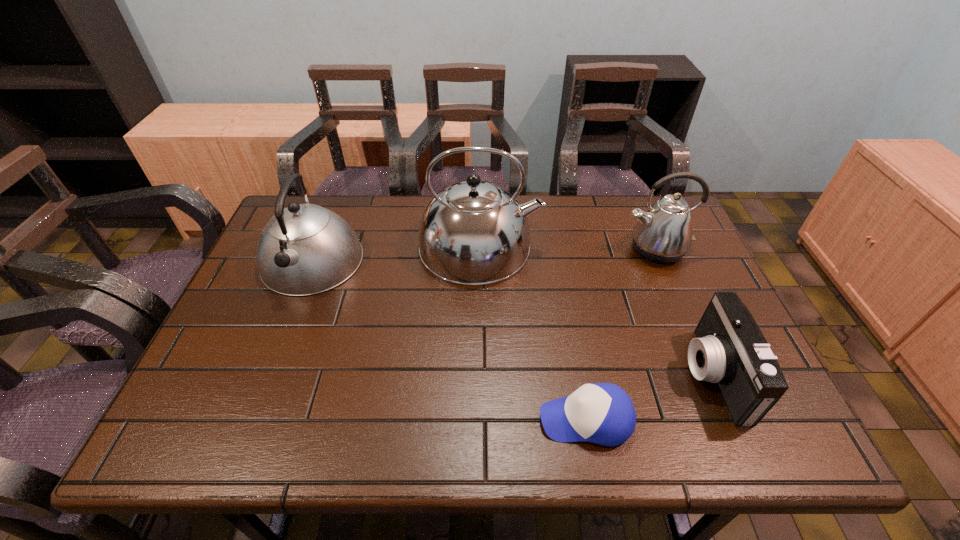
You are a GUI agent. You are given a task and a screenshot of the screen. Output one action in this format:
    pyautogui.click(x=<x>, y=<y>)
    Task: Click on the vacant space positioned 0.260m on the lens of the fourth tallest object
    Image resolution: width=960 pixels, height=540 pixels.
    Given the screenshot: What is the action you would take?
    pos(573,375)

The height and width of the screenshot is (540, 960). In order to click on free space located on the lens of the fourth tallest object in this screenshot , I will do `click(600, 375)`.

The width and height of the screenshot is (960, 540). Identify the location of vacant space located 0.260m on the front-facing side of the shortest object. (415, 419).

Locate an element on the screen. This screenshot has width=960, height=540. free point located on the front-facing side of the shortest object is located at coordinates (477, 419).

In order to click on free region located on the front-facing side of the shortest object in this screenshot , I will do `click(501, 419)`.

Where is `camcorder that is positioned at the near edge`? This screenshot has height=540, width=960. camcorder that is positioned at the near edge is located at coordinates (730, 350).

What are the coordinates of `baseball cap that is at the near edge` in the screenshot? It's located at pyautogui.click(x=602, y=413).

Locate an element on the screen. This screenshot has height=540, width=960. object that is at the left edge is located at coordinates (305, 249).

Where is `kettle that is at the right edge`? This screenshot has width=960, height=540. kettle that is at the right edge is located at coordinates (663, 234).

Where is `camcorder present at the right edge`? This screenshot has height=540, width=960. camcorder present at the right edge is located at coordinates (730, 350).